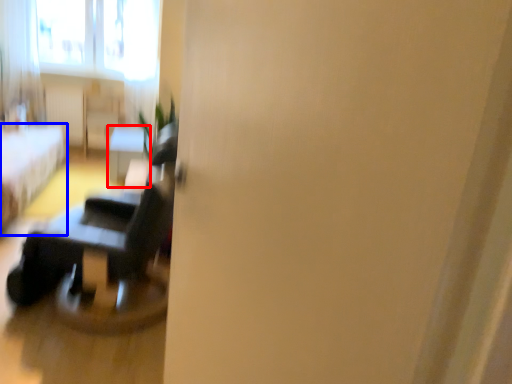
Question: Which object appears farthest to the camera in this image, table (highlighted by a red box) or furniture (highlighted by a blue box)?

Choices:
 (A) table
 (B) furniture

Answer: (A)